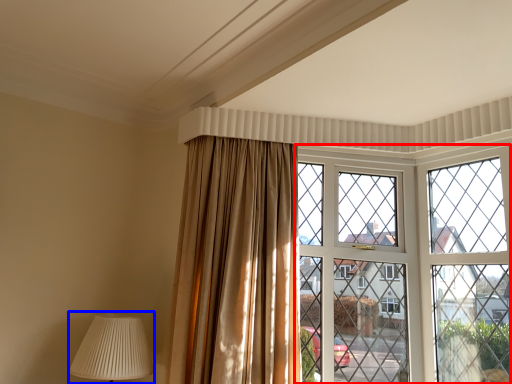
Question: Which point is closer to the camera, window (highlighted by a red box) or table lamp (highlighted by a blue box)?

Choices:
 (A) window
 (B) table lamp

Answer: (B)